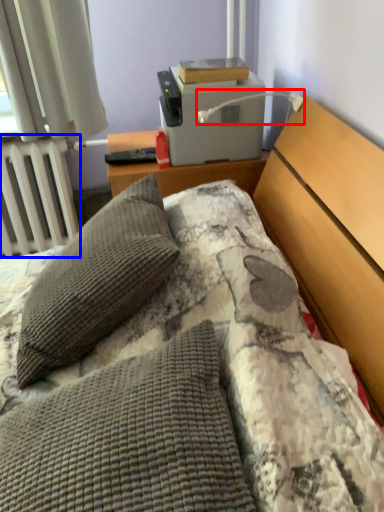
Question: Among these objects, which one is farthest to the camera, lamp (highlighted by a red box) or radiator (highlighted by a blue box)?

Choices:
 (A) lamp
 (B) radiator

Answer: (B)